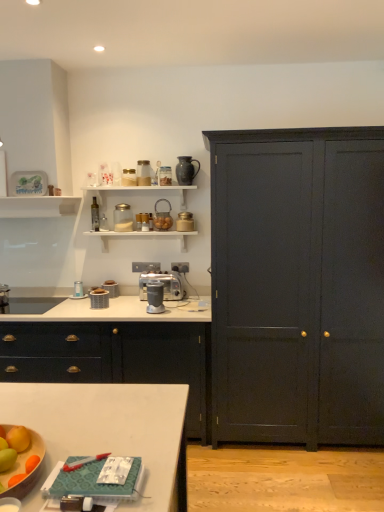
Question: Considering the relative positions of metallic silver toaster at upper center, the eighth appliance in the bottom-to-top sequence, and metallic gold canister at upper center, the fifth appliance positioned from the bottom, in the image provided, is metallic silver toaster at upper center, the eighth appliance in the bottom-to-top sequence, to the left of metallic gold canister at upper center, the fifth appliance positioned from the bottom, from the viewer's perspective?

Choices:
 (A) yes
 (B) no

Answer: (A)

Question: From the image's perspective, is metallic silver toaster at upper center, the eighth appliance in the bottom-to-top sequence, under metallic gold canister at upper center, arranged as the 7th appliance when viewed from the top?

Choices:
 (A) no
 (B) yes

Answer: (A)

Question: Is metallic silver toaster at upper center, which is the 4th appliance from top to bottom, positioned with its back to metallic gold canister at upper center, the fifth appliance positioned from the bottom?

Choices:
 (A) no
 (B) yes

Answer: (A)

Question: Does metallic silver toaster at upper center, which is the 4th appliance from top to bottom, have a greater height compared to metallic gold canister at upper center, the fifth appliance positioned from the bottom?

Choices:
 (A) no
 (B) yes

Answer: (B)

Question: Considering the relative sizes of metallic silver toaster at upper center, the eighth appliance in the bottom-to-top sequence, and metallic gold canister at upper center, arranged as the 7th appliance when viewed from the top, in the image provided, is metallic silver toaster at upper center, the eighth appliance in the bottom-to-top sequence, smaller than metallic gold canister at upper center, arranged as the 7th appliance when viewed from the top,?

Choices:
 (A) no
 (B) yes

Answer: (A)

Question: In the image, is clear glass jar at upper center, marked as the tenth appliance in a bottom-to-top arrangement, on the left side or the right side of matte gray blender at center, the tenth appliance from the top?

Choices:
 (A) left
 (B) right

Answer: (A)

Question: Is clear glass jar at upper center, arranged as the 2th appliance when viewed from the top, situated inside matte gray blender at center, which is counted as the second appliance, starting from the bottom, or outside?

Choices:
 (A) inside
 (B) outside

Answer: (B)

Question: Considering their positions, is clear glass jar at upper center, arranged as the 2th appliance when viewed from the top, located in front of or behind matte gray blender at center, the tenth appliance from the top?

Choices:
 (A) behind
 (B) front

Answer: (A)

Question: In terms of width, does clear glass jar at upper center, arranged as the 2th appliance when viewed from the top, look wider or thinner when compared to matte gray blender at center, the tenth appliance from the top?

Choices:
 (A) thin
 (B) wide

Answer: (B)

Question: From a real-world perspective, is metallic silver toaster at center, arranged as the third appliance when ordered from the bottom, physically located above or below metallic silver toaster at center, the 11th appliance from the top?

Choices:
 (A) above
 (B) below

Answer: (B)

Question: Considering the positions of metallic silver toaster at center, arranged as the third appliance when ordered from the bottom, and metallic silver toaster at center, the 11th appliance from the top, in the image, is metallic silver toaster at center, arranged as the third appliance when ordered from the bottom, wider or thinner than metallic silver toaster at center, the 11th appliance from the top,?

Choices:
 (A) thin
 (B) wide

Answer: (A)

Question: In the image, is metallic silver toaster at center, acting as the 9th appliance starting from the top, positioned in front of or behind metallic silver toaster at center, acting as the 1th appliance starting from the bottom?

Choices:
 (A) behind
 (B) front

Answer: (A)

Question: Choose the correct answer: Is metallic silver toaster at center, arranged as the third appliance when ordered from the bottom, inside metallic silver toaster at center, the 11th appliance from the top, or outside it?

Choices:
 (A) inside
 (B) outside

Answer: (B)

Question: Based on their sizes in the image, would you say matte black cabinet at center is bigger or smaller than metallic gold canister at upper center, the fifth appliance positioned from the bottom?

Choices:
 (A) big
 (B) small

Answer: (A)

Question: Is matte black cabinet at center taller or shorter than metallic gold canister at upper center, the fifth appliance positioned from the bottom?

Choices:
 (A) tall
 (B) short

Answer: (A)